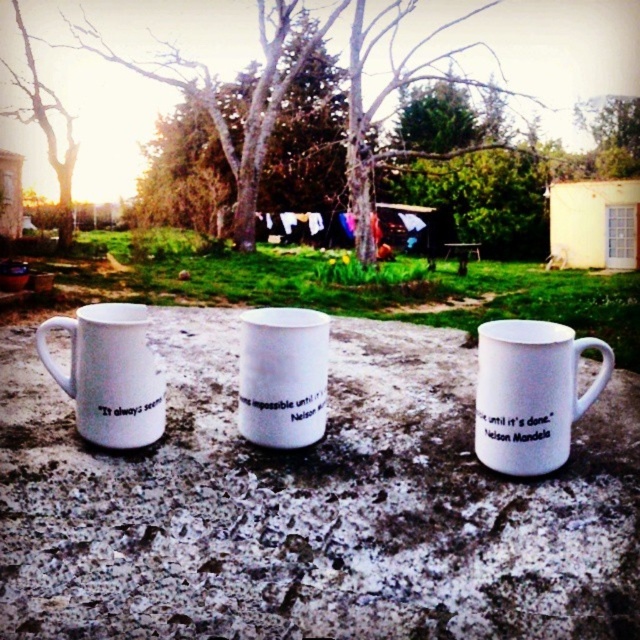
Looking at this image, who is taller, white ceramic mug at center or white matte mug at left?

white matte mug at left

Which is more to the right, white ceramic mug at center or white matte mug at left?

Positioned to the right is white ceramic mug at center.

Is point (481, 378) farther from viewer compared to point (92, 321)?

Yes.

You are a GUI agent. You are given a task and a screenshot of the screen. Output one action in this format:
    pyautogui.click(x=<x>, y=<y>)
    Task: Click on the white ceramic mug at center
    
    Given the screenshot: What is the action you would take?
    pyautogui.click(x=531, y=394)

Is white ceramic mug at center thinner than white matte mug at center?

No.

Between white ceramic mug at center and white matte mug at center, which one appears on the left side from the viewer's perspective?

From the viewer's perspective, white matte mug at center appears more on the left side.

Measure the distance between point (x=589, y=388) and camera.

They are 4.09 feet apart.

Locate an element on the screen. white ceramic mug at center is located at coordinates (531, 394).

Does white matte mug at left appear over white matte mug at center?

Yes.

Is point (100, 349) farther from viewer compared to point (301, 336)?

No, it is not.

Where is `white matte mug at left`? The width and height of the screenshot is (640, 640). white matte mug at left is located at coordinates (109, 374).